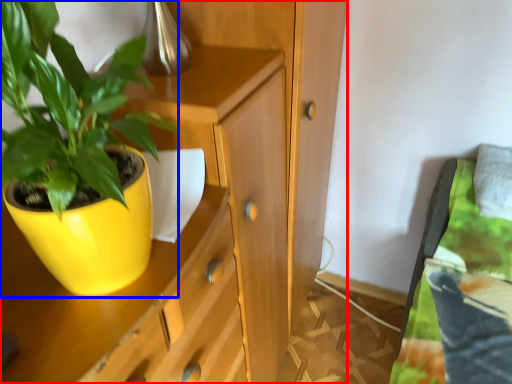
Question: Among these objects, which one is nearest to the camera, cabinetry (highlighted by a red box) or houseplant (highlighted by a blue box)?

Choices:
 (A) cabinetry
 (B) houseplant

Answer: (B)